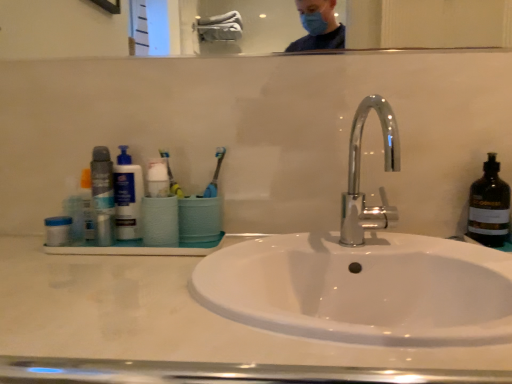
Question: Can you confirm if yellow rubber toothbrush at center is shorter than chrome/metallic faucet at center?

Choices:
 (A) yes
 (B) no

Answer: (A)

Question: Is chrome/metallic faucet at center at the back of yellow rubber toothbrush at center?

Choices:
 (A) no
 (B) yes

Answer: (A)

Question: Is yellow rubber toothbrush at center positioned behind chrome/metallic faucet at center?

Choices:
 (A) yes
 (B) no

Answer: (A)

Question: Can you confirm if yellow rubber toothbrush at center is positioned to the right of chrome/metallic faucet at center?

Choices:
 (A) no
 (B) yes

Answer: (A)

Question: Considering the relative sizes of yellow rubber toothbrush at center and chrome/metallic faucet at center in the image provided, is yellow rubber toothbrush at center thinner than chrome/metallic faucet at center?

Choices:
 (A) no
 (B) yes

Answer: (B)

Question: Does yellow rubber toothbrush at center have a smaller size compared to chrome/metallic faucet at center?

Choices:
 (A) no
 (B) yes

Answer: (B)

Question: Is white glossy sink at center at the back of chrome/metallic faucet at center?

Choices:
 (A) no
 (B) yes

Answer: (A)

Question: Is chrome/metallic faucet at center outside white glossy sink at center?

Choices:
 (A) no
 (B) yes

Answer: (B)

Question: Does chrome/metallic faucet at center touch white glossy sink at center?

Choices:
 (A) yes
 (B) no

Answer: (B)

Question: Considering the relative sizes of chrome/metallic faucet at center and white glossy sink at center in the image provided, is chrome/metallic faucet at center taller than white glossy sink at center?

Choices:
 (A) no
 (B) yes

Answer: (B)

Question: From a real-world perspective, is chrome/metallic faucet at center beneath white glossy sink at center?

Choices:
 (A) yes
 (B) no

Answer: (B)

Question: From the image's perspective, is chrome/metallic faucet at center beneath white glossy sink at center?

Choices:
 (A) yes
 (B) no

Answer: (B)

Question: Does matte plastic bottle at left have a larger size compared to yellow rubber toothbrush at center?

Choices:
 (A) yes
 (B) no

Answer: (A)